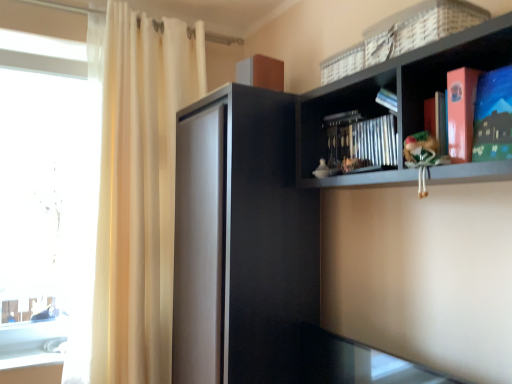
Question: In the image, is matte paper book at upper right positioned in front of or behind white woven basket at upper right?

Choices:
 (A) front
 (B) behind

Answer: (A)

Question: Is matte paper book at upper right taller or shorter than white woven basket at upper right?

Choices:
 (A) short
 (B) tall

Answer: (B)

Question: Considering the real-world distances, which object is farthest from the transparent glass window at left?

Choices:
 (A) black matte shelf at upper right
 (B) green fabric doll at right
 (C) white woven basket at upper right
 (D) metallic silver book at center
 (E) matte paper book at upper right

Answer: (E)

Question: Based on their relative distances, which object is nearer to the black matte shelf at upper right?

Choices:
 (A) matte paper book at upper right
 (B) transparent glass window at left
 (C) black matte cabinet at center
 (D) green fabric doll at right
 (E) metallic silver book at center

Answer: (E)